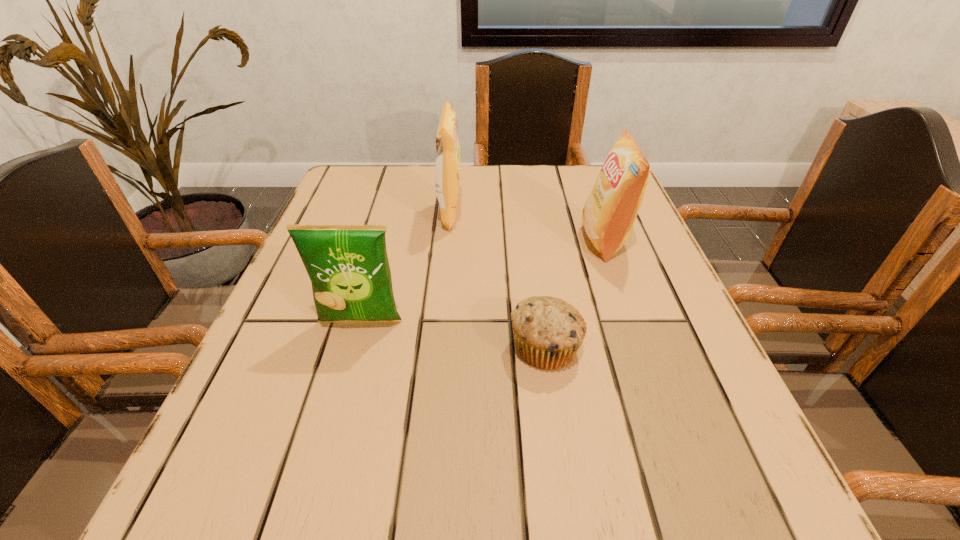
The image size is (960, 540). In order to click on vacant space located on the front-facing side of the leftmost object in this screenshot , I will do `click(307, 514)`.

In order to click on free space located on the left of the muffin in this screenshot , I will do `click(406, 347)`.

Where is `object that is at the far edge`? The width and height of the screenshot is (960, 540). object that is at the far edge is located at coordinates (447, 170).

Where is `object that is at the left edge`? object that is at the left edge is located at coordinates (348, 266).

The width and height of the screenshot is (960, 540). I want to click on object located at the right edge, so click(610, 211).

You are a GUI agent. You are given a task and a screenshot of the screen. Output one action in this format:
    pyautogui.click(x=<x>, y=<y>)
    Task: Click on the free spot at the far edge of the desktop
    
    Given the screenshot: What is the action you would take?
    pyautogui.click(x=547, y=172)

You are a GUI agent. You are given a task and a screenshot of the screen. Output one action in this format:
    pyautogui.click(x=<x>, y=<y>)
    Task: Click on the blank area at the near edge
    Image resolution: width=960 pixels, height=540 pixels.
    Given the screenshot: What is the action you would take?
    pyautogui.click(x=528, y=529)

The image size is (960, 540). In the image, there is a desktop. Find the location of `vacant space at the left edge`. vacant space at the left edge is located at coordinates (337, 219).

Where is `free space at the right edge of the desktop`? This screenshot has height=540, width=960. free space at the right edge of the desktop is located at coordinates (697, 328).

In order to click on blank space at the far left corner of the desktop in this screenshot , I will do `click(389, 198)`.